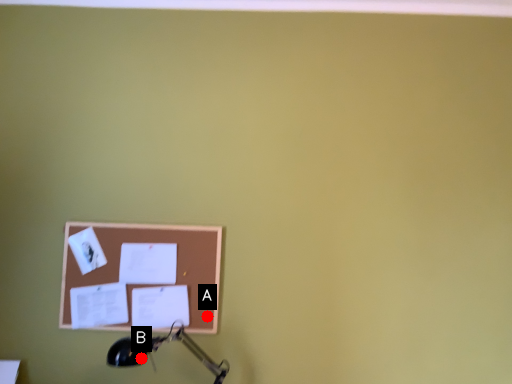
Question: Two points are circled on the image, labeled by A and B beside each circle. Which point is closer to the camera?

Choices:
 (A) A is closer
 (B) B is closer

Answer: (B)